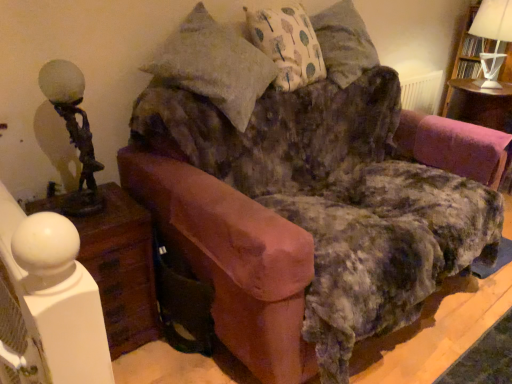
Question: Is velvet pink swivel chair at right at the right side of white fabric pillow with tree pattern at upper center?

Choices:
 (A) yes
 (B) no

Answer: (A)

Question: Can you confirm if velvet pink swivel chair at right is shorter than white fabric pillow with tree pattern at upper center?

Choices:
 (A) yes
 (B) no

Answer: (A)

Question: Does velvet pink swivel chair at right have a greater width compared to white fabric pillow with tree pattern at upper center?

Choices:
 (A) yes
 (B) no

Answer: (A)

Question: From the image's perspective, is velvet pink swivel chair at right under white fabric pillow with tree pattern at upper center?

Choices:
 (A) no
 (B) yes

Answer: (B)

Question: From a real-world perspective, does velvet pink swivel chair at right sit lower than white fabric pillow with tree pattern at upper center?

Choices:
 (A) yes
 (B) no

Answer: (A)

Question: Can you confirm if velvet pink swivel chair at right is taller than white fabric pillow with tree pattern at upper center?

Choices:
 (A) no
 (B) yes

Answer: (A)

Question: Is white wood nightstand at lower left outside white fabric pillow with tree pattern at upper center?

Choices:
 (A) no
 (B) yes

Answer: (B)

Question: Can you confirm if white wood nightstand at lower left is positioned to the right of white fabric pillow with tree pattern at upper center?

Choices:
 (A) yes
 (B) no

Answer: (B)

Question: From a real-world perspective, is white wood nightstand at lower left over white fabric pillow with tree pattern at upper center?

Choices:
 (A) yes
 (B) no

Answer: (B)

Question: Are white wood nightstand at lower left and white fabric pillow with tree pattern at upper center making contact?

Choices:
 (A) no
 (B) yes

Answer: (A)

Question: Could you tell me if white wood nightstand at lower left is facing white fabric pillow with tree pattern at upper center?

Choices:
 (A) no
 (B) yes

Answer: (A)

Question: Can you confirm if white wood nightstand at lower left is bigger than white fabric pillow with tree pattern at upper center?

Choices:
 (A) yes
 (B) no

Answer: (A)

Question: Can you confirm if white fabric lampshade at upper right, positioned as the 2th table lamp in front-to-back order, is bigger than white paper lampshade at upper right?

Choices:
 (A) no
 (B) yes

Answer: (A)